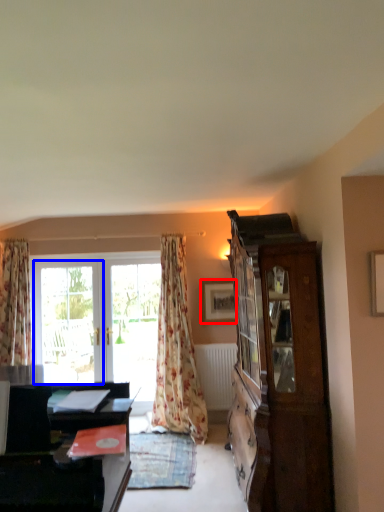
Question: Which of the following is the closest to the observer, picture frame (highlighted by a red box) or window (highlighted by a blue box)?

Choices:
 (A) picture frame
 (B) window

Answer: (A)